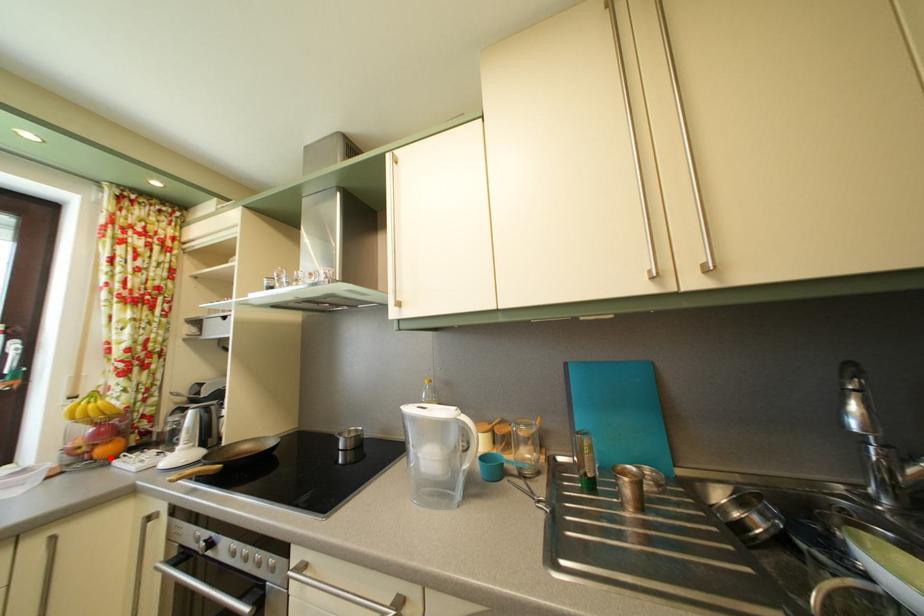
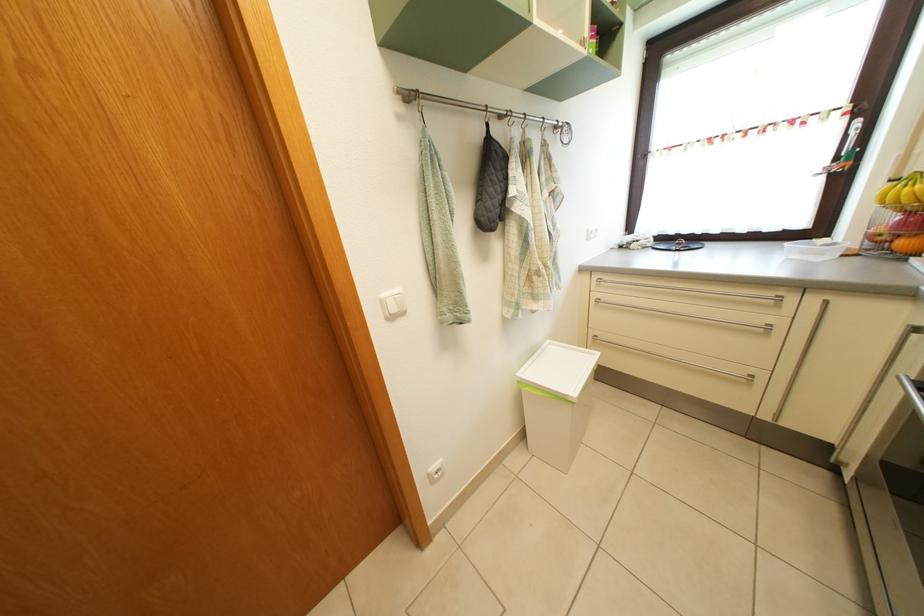
The point at the highlighted location is marked in the first image. Where is the corresponding point in the second image?

(910, 252)